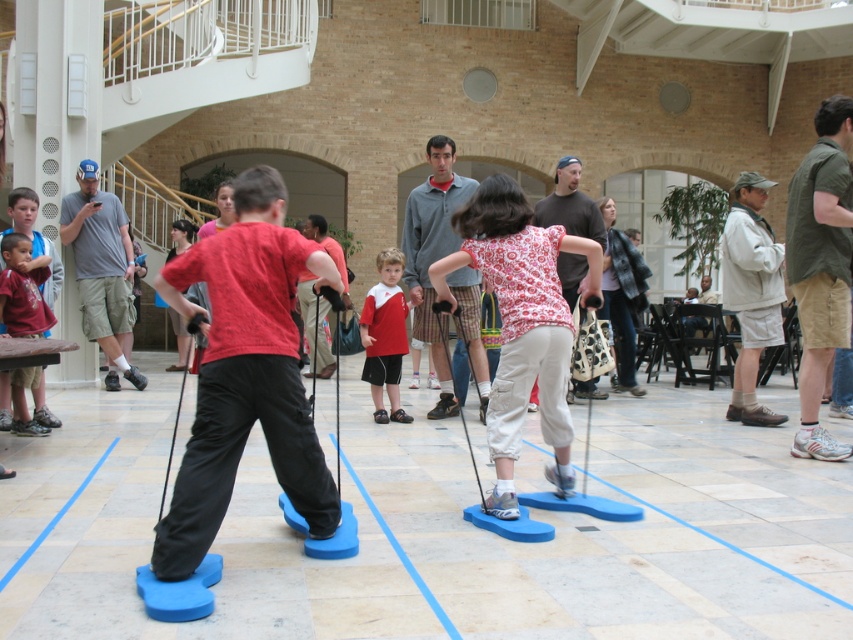
Between point (839, 202) and point (550, 212), which one is positioned behind?

The point (550, 212) is more distant.

How far apart are green cotton shirt at right and dark brown sweater at center?

The distance of green cotton shirt at right from dark brown sweater at center is 2.33 meters.

Does point (828, 170) come farther from viewer compared to point (567, 292)?

No, (828, 170) is closer to viewer.

You are a GUI agent. You are given a task and a screenshot of the screen. Output one action in this format:
    pyautogui.click(x=<x>, y=<y>)
    Task: Click on the green cotton shirt at right
    
    Given the screenshot: What is the action you would take?
    pyautogui.click(x=820, y=266)

From the picture: Can you confirm if gray fleece jacket at center is taller than gray cotton shirt at left?

Yes, gray fleece jacket at center is taller than gray cotton shirt at left.

Is point (463, 188) more distant than point (120, 342)?

No, it is in front of (120, 342).

Where is `gray fleece jacket at center`? The width and height of the screenshot is (853, 640). gray fleece jacket at center is located at coordinates (433, 253).

Does floral-patterned shirt at center appear on the left side of gray fleece jacket at center?

No, floral-patterned shirt at center is not to the left of gray fleece jacket at center.

Is the position of floral-patterned shirt at center more distant than that of gray fleece jacket at center?

That is False.

This screenshot has height=640, width=853. What do you see at coordinates (521, 324) in the screenshot?
I see `floral-patterned shirt at center` at bounding box center [521, 324].

The height and width of the screenshot is (640, 853). I want to click on floral-patterned shirt at center, so click(x=521, y=324).